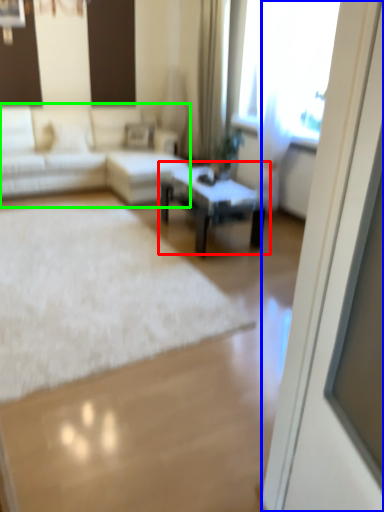
Question: Which object is positioned farthest from coffee table (highlighted by a red box)? Select from screen door (highlighted by a blue box) and studio couch (highlighted by a green box).

Choices:
 (A) screen door
 (B) studio couch

Answer: (A)